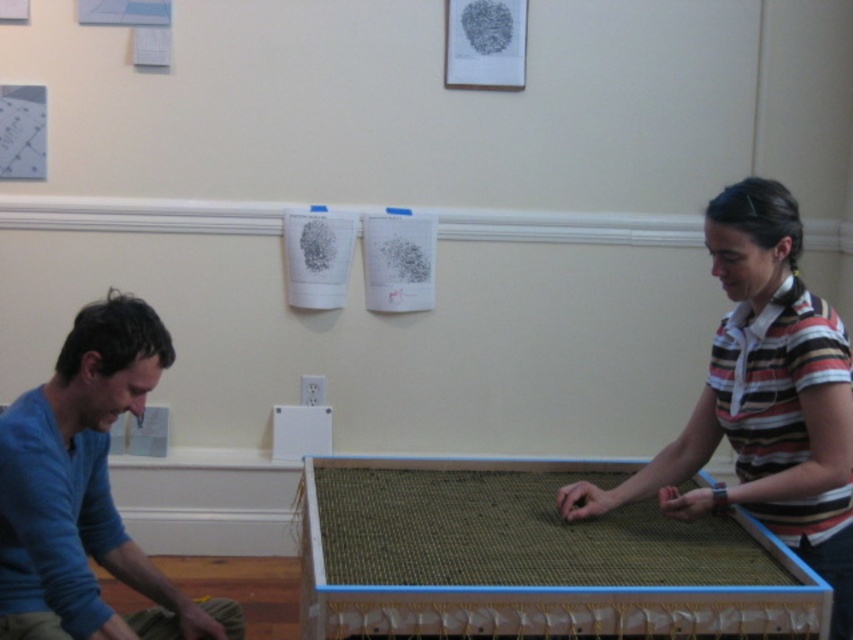
Question: Which point is closer to the camera?

Choices:
 (A) striped cotton shirt at center
 (B) blue cotton shirt at left

Answer: (B)

Question: Which point appears farthest from the camera in this image?

Choices:
 (A) (840, 564)
 (B) (18, 632)

Answer: (A)

Question: Does striped cotton shirt at center appear on the left side of blue cotton shirt at left?

Choices:
 (A) no
 (B) yes

Answer: (A)

Question: Considering the relative positions of striped cotton shirt at center and blue cotton shirt at left in the image provided, where is striped cotton shirt at center located with respect to blue cotton shirt at left?

Choices:
 (A) below
 (B) above

Answer: (B)

Question: Does striped cotton shirt at center come behind blue cotton shirt at left?

Choices:
 (A) yes
 (B) no

Answer: (A)